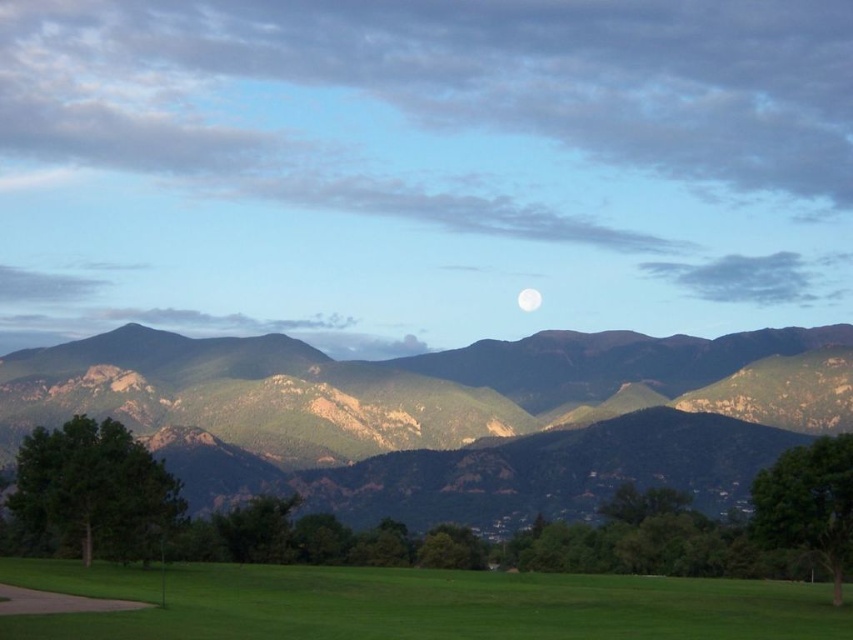
You are standing in the park and want to take a photo of the green grass at lower center and the green textured mountains at center. Which object will appear closer to you in the photo?

The green textured mountains at center will appear closer to you in the photo because the green grass at lower center is behind them, making the mountains the foreground element.

You are standing in the park and want to take a photo of the white glossy moon at center. You have a camera with a standard lens that can focus up to 500 meters. Will the green grass at lower center be in focus if you focus on the moon?

The green grass at lower center is 475.22 meters from the white glossy moon at center. If you focus on the moon, the grass will be within the camera lens focus range since it is less than 500 meters away.

You are an astronomer observing the night sky and the landscape. You notice the green textured mountains at center and the white glossy moon at center. Which object is positioned lower in the scene?

The green textured mountains at center is positioned lower than the white glossy moon at center.